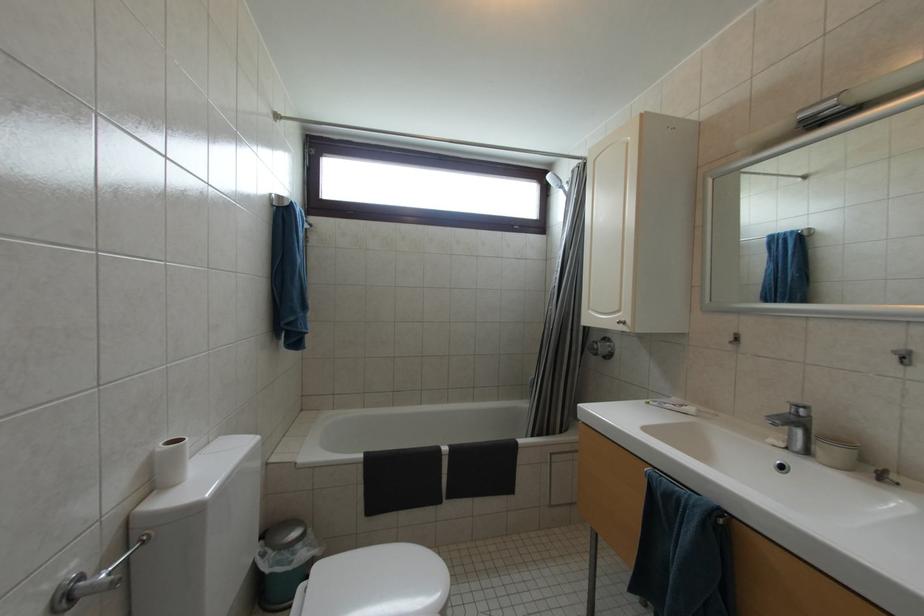
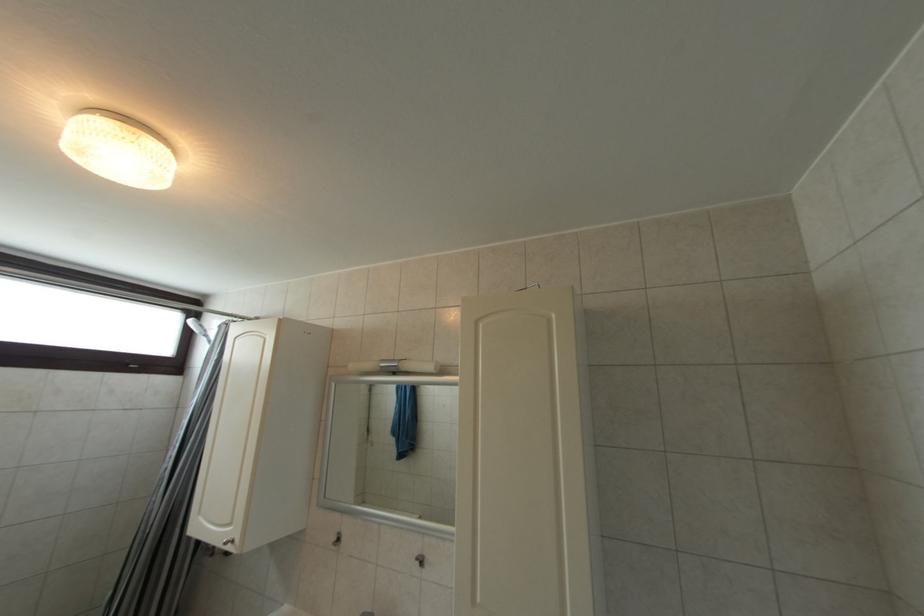
Question: The first image is from the beginning of the video and the second image is from the end. How did the camera likely rotate when shooting the video?

Choices:
 (A) Left
 (B) Right
 (C) Up
 (D) Down

Answer: (B)